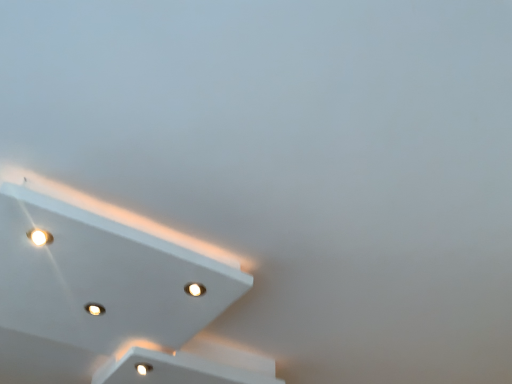
Image resolution: width=512 pixels, height=384 pixels. In order to click on white glossy light at bottom left, arranged as the first dot when viewed from the back in this screenshot , I will do `click(143, 368)`.

At what (x,y) coordinates should I click in order to perform the action: click on matte white light at upper left, acting as the first dot starting from the left. Please return your answer as a coordinate pair (x, y). The height and width of the screenshot is (384, 512). Looking at the image, I should click on (40, 237).

You are a GUI agent. You are given a task and a screenshot of the screen. Output one action in this format:
    pyautogui.click(x=<x>, y=<y>)
    Task: Click on the white glossy light at bottom left, arranged as the first dot when viewed from the back
    This screenshot has height=384, width=512.
    Given the screenshot: What is the action you would take?
    pyautogui.click(x=143, y=368)

Is point (149, 369) more distant than point (129, 266)?

Yes.

Is white glossy light at bottom left, the 2th dot when ordered from front to back, outside of white glossy light fixture at upper left?

Yes, white glossy light at bottom left, the 2th dot when ordered from front to back, is not within white glossy light fixture at upper left.

Is there a large distance between white glossy light at bottom left, the 2th dot viewed from the top, and white glossy light fixture at upper left?

white glossy light at bottom left, the 2th dot viewed from the top, is near white glossy light fixture at upper left, not far away.

Which object is more forward, white glossy light at bottom left, the 1th dot in the right-to-left sequence, or white glossy light fixture at upper left?

white glossy light fixture at upper left is more forward.

Which is in front, white glossy light fixture at upper left or white glossy light at bottom left, the 2th dot when ordered from front to back?

white glossy light fixture at upper left.

Considering the relative sizes of white glossy light fixture at upper left and white glossy light at bottom left, the 2th dot viewed from the top, in the image provided, is white glossy light fixture at upper left taller than white glossy light at bottom left, the 2th dot viewed from the top,?

Correct, white glossy light fixture at upper left is much taller as white glossy light at bottom left, the 2th dot viewed from the top.

Which is more to the left, white glossy light fixture at upper left or white glossy light at bottom left, the 2th dot when ordered from front to back?

From the viewer's perspective, white glossy light fixture at upper left appears more on the left side.

Considering the relative sizes of white glossy light fixture at upper left and white glossy light at bottom left, the 1th dot when ordered from bottom to top, in the image provided, is white glossy light fixture at upper left thinner than white glossy light at bottom left, the 1th dot when ordered from bottom to top,?

Incorrect, the width of white glossy light fixture at upper left is not less than that of white glossy light at bottom left, the 1th dot when ordered from bottom to top.

From a real-world perspective, is matte white light at upper left, acting as the first dot starting from the left, below white glossy light at bottom left, the 2th dot when ordered from front to back?

No, from a real-world perspective, matte white light at upper left, acting as the first dot starting from the left, is not beneath white glossy light at bottom left, the 2th dot when ordered from front to back.

Can you tell me how much matte white light at upper left, the 2th dot ordered from the bottom, and white glossy light at bottom left, the 1th dot in the right-to-left sequence, differ in facing direction?

The angle between the facing direction of matte white light at upper left, the 2th dot ordered from the bottom, and the facing direction of white glossy light at bottom left, the 1th dot in the right-to-left sequence, is 8.29 degrees.

Consider the image. Considering the relative sizes of matte white light at upper left, acting as the first dot starting from the left, and white glossy light at bottom left, the 1th dot when ordered from bottom to top, in the image provided, is matte white light at upper left, acting as the first dot starting from the left, smaller than white glossy light at bottom left, the 1th dot when ordered from bottom to top,?

Correct, matte white light at upper left, acting as the first dot starting from the left, occupies less space than white glossy light at bottom left, the 1th dot when ordered from bottom to top.

Is white glossy light fixture at upper left beside matte white light at upper left, placed as the 2th dot when sorted from right to left?

No, white glossy light fixture at upper left is not next to matte white light at upper left, placed as the 2th dot when sorted from right to left.

Is white glossy light fixture at upper left turned away from matte white light at upper left, placed as the 2th dot when sorted from right to left?

No.

From the image's perspective, would you say white glossy light fixture at upper left is positioned over matte white light at upper left, which ranks as the 1th dot in front-to-back order?

No, from the image's perspective, white glossy light fixture at upper left is not above matte white light at upper left, which ranks as the 1th dot in front-to-back order.

Would you say white glossy light fixture at upper left contains matte white light at upper left, the 2th dot ordered from the bottom?

Absolutely, matte white light at upper left, the 2th dot ordered from the bottom, is inside white glossy light fixture at upper left.

The width and height of the screenshot is (512, 384). Find the location of `lamp in front of the matte white light at upper left, acting as the first dot starting from the left`. lamp in front of the matte white light at upper left, acting as the first dot starting from the left is located at coordinates (108, 300).

Is white glossy light fixture at upper left a part of matte white light at upper left, which ranks as the 1th dot in front-to-back order?

No, matte white light at upper left, which ranks as the 1th dot in front-to-back order, does not contain white glossy light fixture at upper left.

Does matte white light at upper left, the second dot when ordered from back to front, have a lesser height compared to white glossy light fixture at upper left?

Correct, matte white light at upper left, the second dot when ordered from back to front, is not as tall as white glossy light fixture at upper left.

Between white glossy light at bottom left, the 2th dot when ordered from front to back, and matte white light at upper left, acting as the first dot starting from the left, which one has less height?

matte white light at upper left, acting as the first dot starting from the left, is shorter.

Is white glossy light at bottom left, the 1th dot when ordered from bottom to top, inside the boundaries of matte white light at upper left, the second dot when ordered from back to front, or outside?

white glossy light at bottom left, the 1th dot when ordered from bottom to top, lies outside matte white light at upper left, the second dot when ordered from back to front.

Does white glossy light at bottom left, the 2th dot in the left-to-right sequence, turn towards matte white light at upper left, the second dot when ordered from back to front?

No, white glossy light at bottom left, the 2th dot in the left-to-right sequence, is not oriented towards matte white light at upper left, the second dot when ordered from back to front.

In the scene shown: Is white glossy light at bottom left, the 2th dot in the left-to-right sequence, wider or thinner than matte white light at upper left, the 2th dot ordered from the bottom?

Clearly, white glossy light at bottom left, the 2th dot in the left-to-right sequence, has more width compared to matte white light at upper left, the 2th dot ordered from the bottom.

At what (x,y) coordinates should I click in order to perform the action: click on lamp that appears in front of the white glossy light at bottom left, the 2th dot viewed from the top. Please return your answer as a coordinate pair (x, y). Image resolution: width=512 pixels, height=384 pixels. Looking at the image, I should click on (108, 300).

Identify the location of dot located on the right of white glossy light fixture at upper left. The image size is (512, 384). (143, 368).

Considering their positions, is white glossy light fixture at upper left positioned further to white glossy light at bottom left, the 2th dot viewed from the top, than matte white light at upper left, the second dot when ordered from back to front?

Among the two, matte white light at upper left, the second dot when ordered from back to front, is located further to white glossy light at bottom left, the 2th dot viewed from the top.

Which object lies nearer to the anchor point white glossy light fixture at upper left, white glossy light at bottom left, the 1th dot when ordered from bottom to top, or matte white light at upper left, the 2th dot ordered from the bottom?

The object closer to white glossy light fixture at upper left is white glossy light at bottom left, the 1th dot when ordered from bottom to top.

Considering their positions, is white glossy light fixture at upper left positioned further to matte white light at upper left, which ranks as the 1th dot in front-to-back order, than white glossy light at bottom left, the 2th dot viewed from the top?

white glossy light at bottom left, the 2th dot viewed from the top.

Based on their spatial positions, is matte white light at upper left, which ranks as the 1th dot in front-to-back order, or white glossy light at bottom left, the 1th dot when ordered from bottom to top, closer to white glossy light fixture at upper left?

The object closer to white glossy light fixture at upper left is white glossy light at bottom left, the 1th dot when ordered from bottom to top.

Estimate the real-world distances between objects in this image. Which object is further from matte white light at upper left, the 2th dot ordered from the bottom, white glossy light at bottom left, the 2th dot when ordered from front to back, or white glossy light fixture at upper left?

Based on the image, white glossy light at bottom left, the 2th dot when ordered from front to back, appears to be further to matte white light at upper left, the 2th dot ordered from the bottom.

Based on their spatial positions, is matte white light at upper left, which is the first dot from top to bottom, or white glossy light fixture at upper left further from white glossy light at bottom left, arranged as the first dot when viewed from the back?

Result: matte white light at upper left, which is the first dot from top to bottom, is positioned further to the anchor white glossy light at bottom left, arranged as the first dot when viewed from the back.

At what (x,y) coordinates should I click in order to perform the action: click on dot positioned between white glossy light fixture at upper left and white glossy light at bottom left, the 2th dot in the left-to-right sequence, from near to far. Please return your answer as a coordinate pair (x, y). This screenshot has height=384, width=512. Looking at the image, I should click on point(40,237).